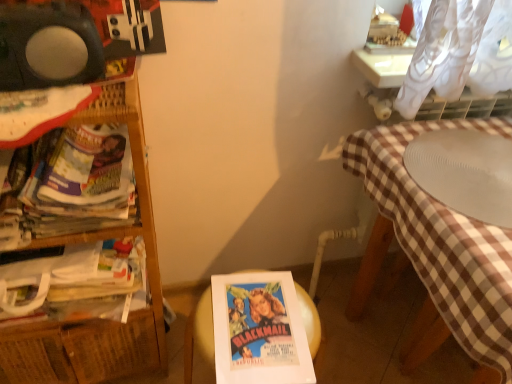
Locate an element on the screen. paperback book at left, which appears as the first book when ordered from the bottom is located at coordinates (76, 283).

Image resolution: width=512 pixels, height=384 pixels. What do you see at coordinates (465, 172) in the screenshot?
I see `white ribbed plate at right` at bounding box center [465, 172].

Locate an element on the screen. The width and height of the screenshot is (512, 384). white paper at center is located at coordinates point(199,334).

At what (x,y) coordinates should I click in order to perform the action: click on woven wood shelf at left. Please return your answer as a coordinate pair (x, y). Looking at the image, I should click on click(98, 323).

From the image's perspective, count 2nd books upward from the white paper at center and point to it. Please provide its 2D coordinates.

[(81, 182)]

Is point (205, 321) positioned in front of point (34, 201)?

No, it is behind (34, 201).

How far apart are white paper at center and white paper book at left, the 1th book viewed from the top?

They are 16.55 inches apart.

Can you confirm if paperback book at left, which is the second book from top to bottom, is thinner than white paper at center?

Yes.

Is white paper at center at the back of paperback book at left, which is the second book from top to bottom?

No, paperback book at left, which is the second book from top to bottom, is not facing the opposite direction of white paper at center.

Which object is positioned more to the left, paperback book at left, which is the second book from top to bottom, or white paper at center?

Positioned to the left is paperback book at left, which is the second book from top to bottom.

Which is correct: paperback book at left, which appears as the first book when ordered from the bottom, is inside white paper at center, or outside of it?

The correct answer is: outside.

Between woven wood shelf at left and white paper at center, which one has smaller width?

Thinner between the two is white paper at center.

Is woven wood shelf at left in front of white paper at center?

Yes, woven wood shelf at left is closer to the camera.

Is woven wood shelf at left looking in the opposite direction of white paper at center?

woven wood shelf at left is not turned away from white paper at center.

From a real-world perspective, relative to white paper at center, is woven wood shelf at left vertically above or below?

Clearly, from a real-world perspective, woven wood shelf at left is above white paper at center.

Which object is thinner, woven wood shelf at left or white ribbed plate at right?

woven wood shelf at left is thinner.

I want to click on round table above the woven wood shelf at left (from the image's perspective), so click(x=465, y=172).

Is point (55, 364) closer or farther from the camera than point (447, 140)?

Point (55, 364) is positioned farther from the camera compared to point (447, 140).

Would you say woven wood shelf at left is to the left or to the right of white ribbed plate at right in the picture?

From the image, it's evident that woven wood shelf at left is to the left of white ribbed plate at right.

Is white paper book at left, the 1th book viewed from the top, positioned with its back to paperback book at left, which appears as the first book when ordered from the bottom?

No.

From the picture: Is white paper book at left, the 1th book viewed from the top, taller than paperback book at left, which appears as the first book when ordered from the bottom?

Yes.

Is point (101, 184) behind point (80, 255)?

No.

Is white paper book at left, positioned as the second book in bottom-to-top order, surrounding paperback book at left, which appears as the first book when ordered from the bottom?

No, white paper book at left, positioned as the second book in bottom-to-top order, does not contain paperback book at left, which appears as the first book when ordered from the bottom.

Which is more distant, (x=86, y=365) or (x=28, y=261)?

The point (x=86, y=365) is farther from the camera.

Is paperback book at left, which is the second book from top to bottom, at the back of woven wood shelf at left?

That's right, woven wood shelf at left is facing away from paperback book at left, which is the second book from top to bottom.

Does woven wood shelf at left appear on the left side of paperback book at left, which appears as the first book when ordered from the bottom?

Correct, you'll find woven wood shelf at left to the left of paperback book at left, which appears as the first book when ordered from the bottom.

Would you say white ribbed plate at right is a long distance from white paper at center?

white ribbed plate at right is actually quite close to white paper at center.

Is white ribbed plate at right in front of or behind white paper at center in the image?

white ribbed plate at right is positioned closer to the viewer than white paper at center.

Between white ribbed plate at right and white paper at center, which one has smaller size?

With smaller size is white paper at center.

Where is `table directly beneath the white paper book at left, positioned as the second book in bottom-to-top order (from a real-world perspective)`? Image resolution: width=512 pixels, height=384 pixels. table directly beneath the white paper book at left, positioned as the second book in bottom-to-top order (from a real-world perspective) is located at coordinates (199, 334).

This screenshot has height=384, width=512. I want to click on the 1st book above the white paper at center (from the image's perspective), so click(x=76, y=283).

Considering their positions, is white ribbed plate at right positioned further to woven wood shelf at left than white paper at center?

white ribbed plate at right.

When comparing their distances from white paper book at left, the 1th book viewed from the top, does white paper at center or white ribbed plate at right seem further?

white ribbed plate at right is further to white paper book at left, the 1th book viewed from the top.

Estimate the real-world distances between objects in this image. Which object is further from woven wood shelf at left, white paper at center or white paper book at left, positioned as the second book in bottom-to-top order?

Among the two, white paper at center is located further to woven wood shelf at left.

Estimate the real-world distances between objects in this image. Which object is closer to white paper at center, white paper book at left, the 1th book viewed from the top, or woven wood shelf at left?

Based on the image, woven wood shelf at left appears to be nearer to white paper at center.

Considering their positions, is white paper at center positioned closer to white ribbed plate at right than woven wood shelf at left?

white paper at center lies closer to white ribbed plate at right than the other object.

From the image, which object appears to be farther from white paper book at left, positioned as the second book in bottom-to-top order, white paper at center or woven wood shelf at left?

white paper at center lies further to white paper book at left, positioned as the second book in bottom-to-top order, than the other object.

Looking at the image, which one is located further to woven wood shelf at left, white ribbed plate at right or white paper book at left, positioned as the second book in bottom-to-top order?

white ribbed plate at right is further to woven wood shelf at left.

Consider the image. Estimate the real-world distances between objects in this image. Which object is further from white ribbed plate at right, white paper book at left, positioned as the second book in bottom-to-top order, or white paper at center?

The object further to white ribbed plate at right is white paper book at left, positioned as the second book in bottom-to-top order.

This screenshot has height=384, width=512. I want to click on book situated between paperback book at left, which is the second book from top to bottom, and white paper at center from left to right, so click(81, 182).

Where is `book between paperback book at left, which is the second book from top to bottom, and white ribbed plate at right, in the horizontal direction`? book between paperback book at left, which is the second book from top to bottom, and white ribbed plate at right, in the horizontal direction is located at coordinates (81, 182).

Find the location of `table located between paperback book at left, which is the second book from top to bottom, and white ribbed plate at right in the left-right direction`. table located between paperback book at left, which is the second book from top to bottom, and white ribbed plate at right in the left-right direction is located at coordinates (199, 334).

Find the location of a particular element. Image resolution: width=512 pixels, height=384 pixels. table situated between white paper book at left, positioned as the second book in bottom-to-top order, and white ribbed plate at right from left to right is located at coordinates (199, 334).